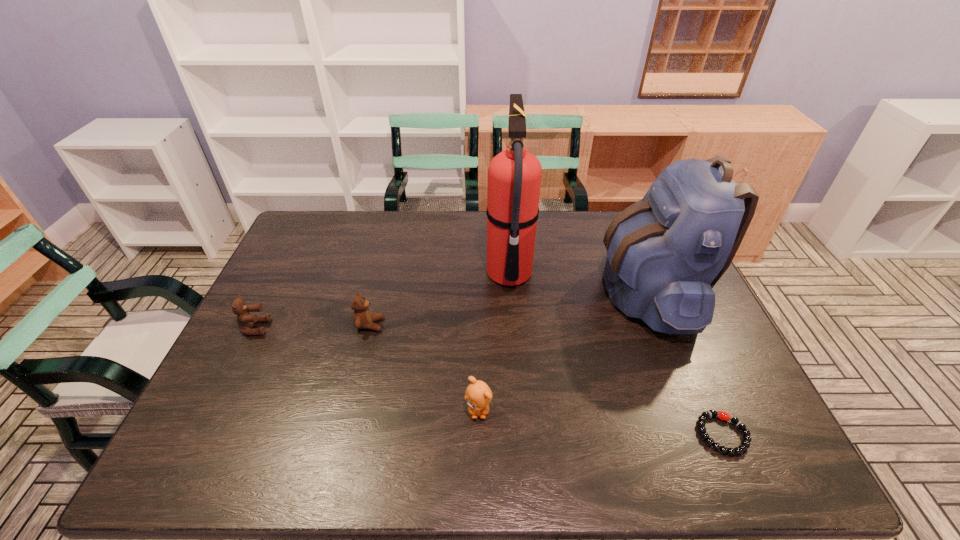
Image resolution: width=960 pixels, height=540 pixels. In order to click on free spot that satisfies the following two spatial constraints: 1. at the face of the fifth object from right to left; 2. on the right side of the shortest object in this screenshot , I will do `click(343, 434)`.

Where is `vacant region that satisfies the following two spatial constraints: 1. on the back side of the shortest object; 2. at the nozzle of the tallest object`? The height and width of the screenshot is (540, 960). vacant region that satisfies the following two spatial constraints: 1. on the back side of the shortest object; 2. at the nozzle of the tallest object is located at coordinates (653, 274).

Locate an element on the screen. Image resolution: width=960 pixels, height=540 pixels. vacant space that satisfies the following two spatial constraints: 1. at the nozzle of the tallest object; 2. on the face of the rightmost teddy bear is located at coordinates (519, 410).

The image size is (960, 540). What are the coordinates of `free spot that satisfies the following two spatial constraints: 1. at the front pocket of the backpack; 2. on the face of the rightmost teddy bear` in the screenshot? It's located at (695, 410).

Find the location of a particular element. blank area in the image that satisfies the following two spatial constraints: 1. at the nozzle of the shortest object; 2. on the right side of the tallest object is located at coordinates (521, 434).

Identify the location of vacant space that satisfies the following two spatial constraints: 1. at the nozzle of the bracelet; 2. on the right side of the fire extinguisher. The image size is (960, 540). (521, 434).

Locate an element on the screen. free space in the image that satisfies the following two spatial constraints: 1. at the face of the shortest object; 2. on the left side of the second teddy bear from right to left is located at coordinates (343, 434).

Locate an element on the screen. free space that satisfies the following two spatial constraints: 1. at the front pocket of the backpack; 2. on the left side of the bracelet is located at coordinates click(x=705, y=434).